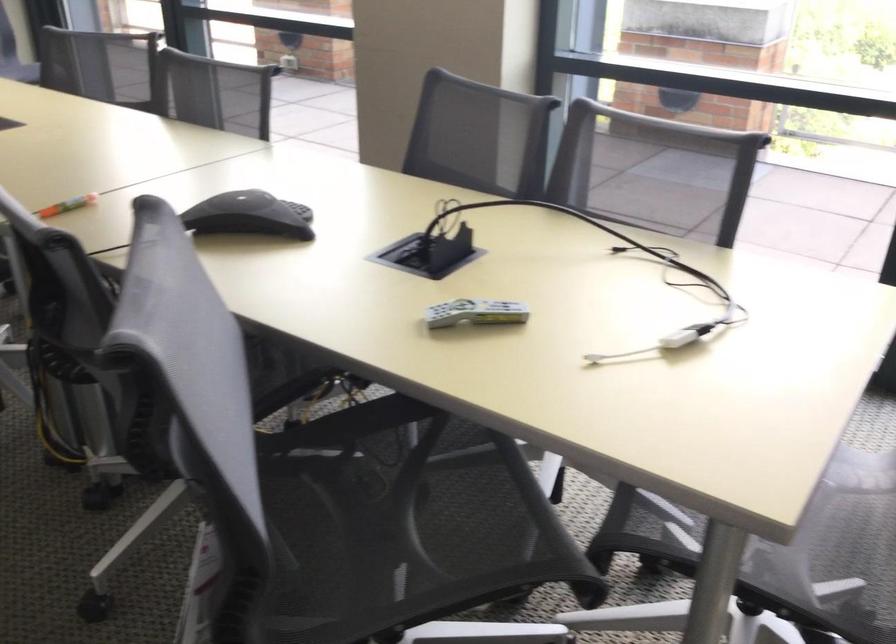
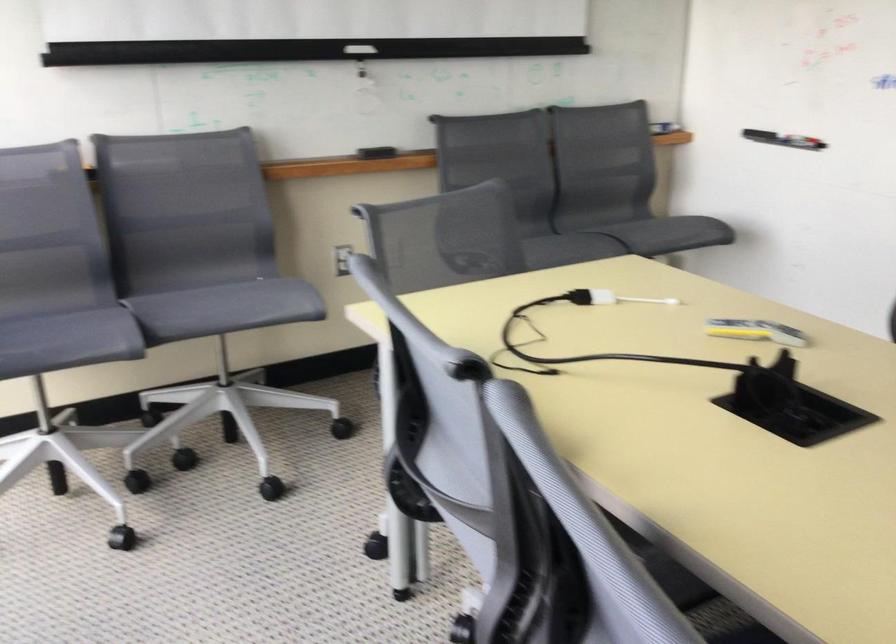
The point at (455, 322) is marked in the first image. Where is the corresponding point in the second image?

(755, 330)